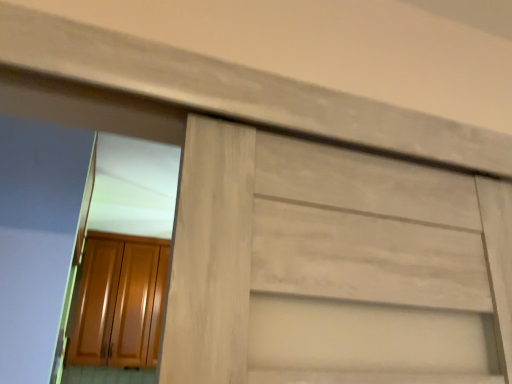
Image resolution: width=512 pixels, height=384 pixels. Describe the element at coordinates (120, 302) in the screenshot. I see `glossy wood cabinet at lower left` at that location.

The height and width of the screenshot is (384, 512). Identify the location of glossy wood cabinet at lower left. (120, 302).

What are the coordinates of `glossy wood cabinet at lower left` in the screenshot? It's located at (120, 302).